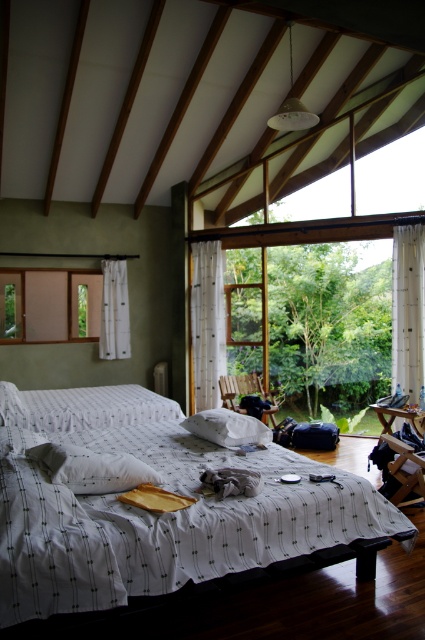
Can you confirm if white soft pillow at center is positioned below wooden rocking chair at center?

No, white soft pillow at center is not below wooden rocking chair at center.

Which is below, white soft pillow at center or wooden rocking chair at center?

wooden rocking chair at center

What do you see at coordinates (90, 468) in the screenshot? The height and width of the screenshot is (640, 425). I see `white soft pillow at center` at bounding box center [90, 468].

This screenshot has height=640, width=425. Identify the location of white soft pillow at center. (90, 468).

Does point (118, 458) come behind point (112, 321)?

No, (118, 458) is closer to viewer.

Identify the location of white soft pillow at center. Image resolution: width=425 pixels, height=640 pixels. (90, 468).

Where is `white soft pillow at center`? The width and height of the screenshot is (425, 640). white soft pillow at center is located at coordinates (90, 468).

Based on the photo, does wooden frame window at left appear under wooden rocking chair at center?

Actually, wooden frame window at left is above wooden rocking chair at center.

Is wooden frame window at left thinner than wooden rocking chair at center?

No.

Locate an element on the screen. wooden frame window at left is located at coordinates (53, 305).